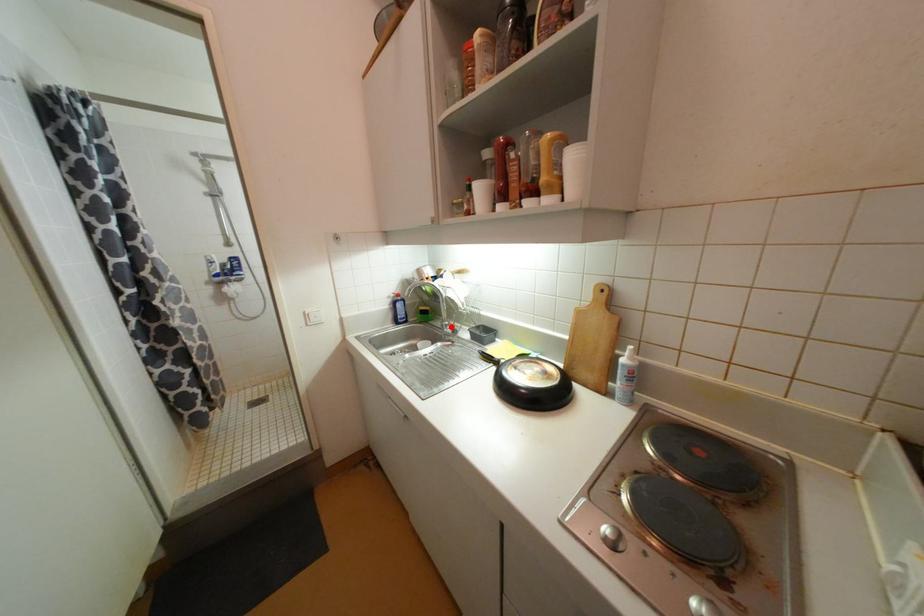
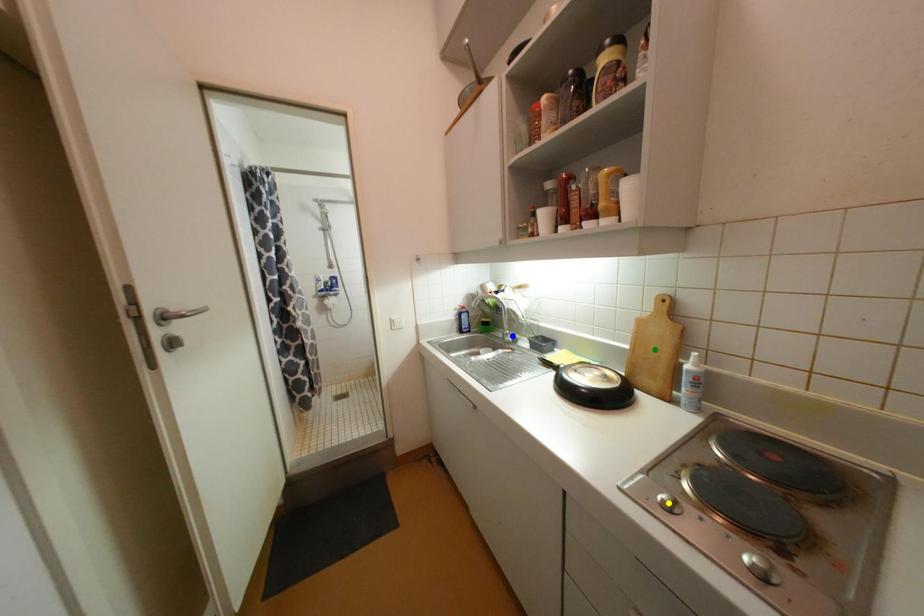
Question: I am providing you with two images of the same scene from different viewpoints. A red point is marked on the first image. You are given multiple points on the second image. Which point in image 2 represents the same 3d spot as the red point in image 1?

Choices:
 (A) yellow point
 (B) green point
 (C) blue point

Answer: (C)